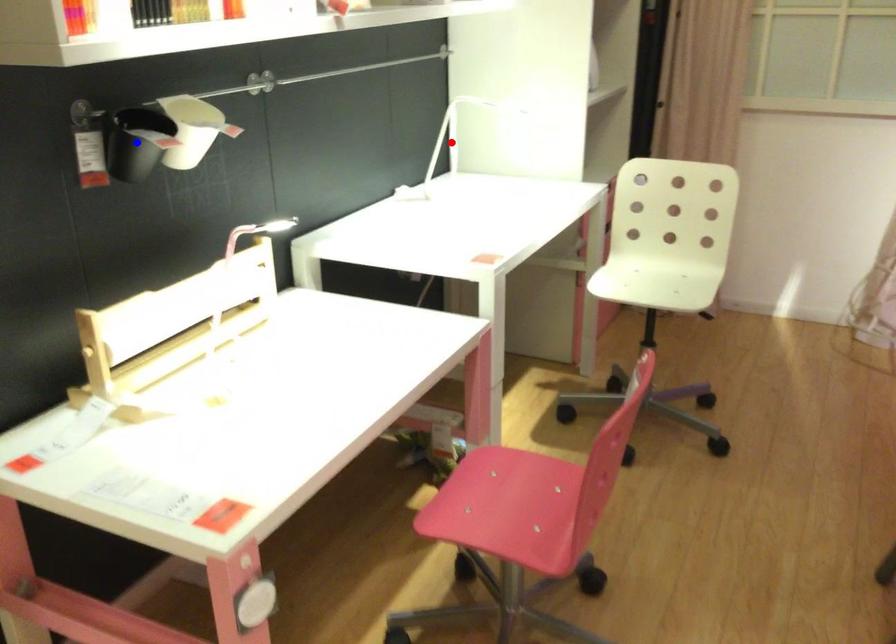
Question: Two points are marked on the image. Which point is closer to the camera?

Choices:
 (A) Blue point is closer.
 (B) Red point is closer.

Answer: (A)